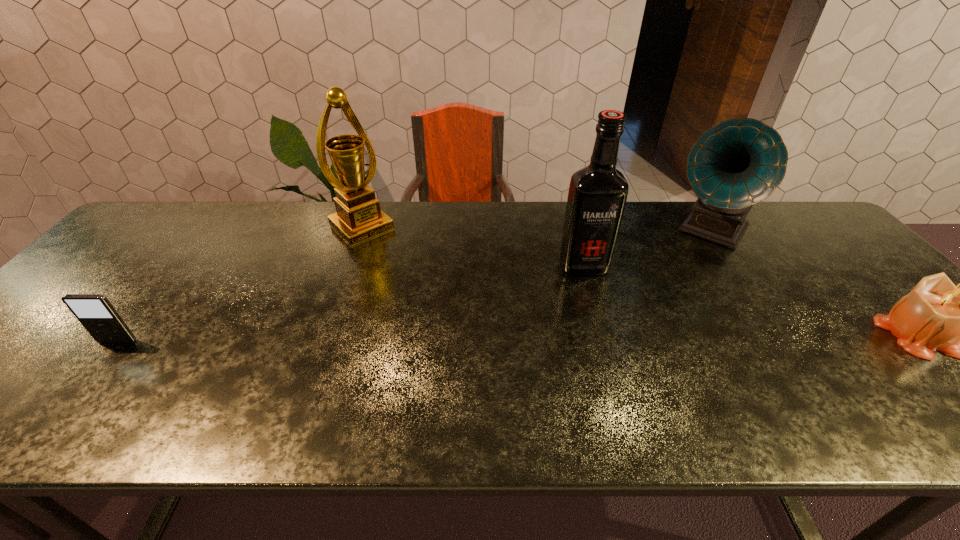
Where is `vacant space that satisfies the following two spatial constraints: 1. on the front side of the liquor; 2. on the right side of the second object from left to right`? vacant space that satisfies the following two spatial constraints: 1. on the front side of the liquor; 2. on the right side of the second object from left to right is located at coordinates (348, 265).